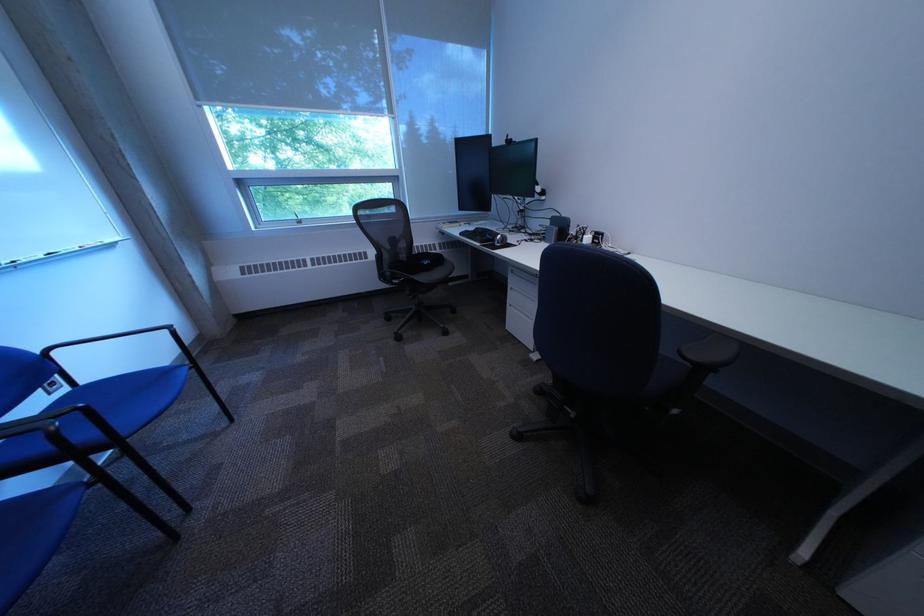
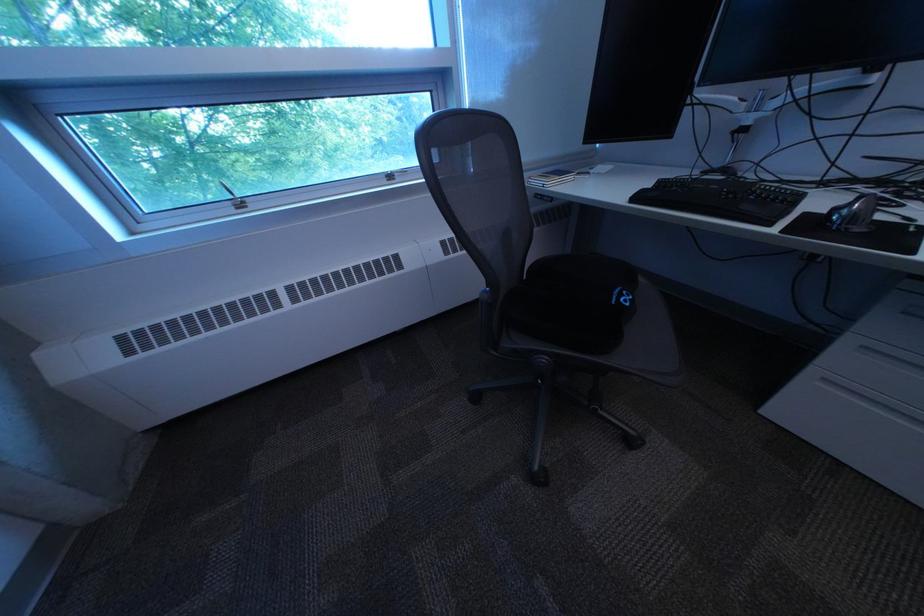
The images are taken continuously from a first-person perspective. In which direction are you moving?

The cameraman moved toward left, forward.